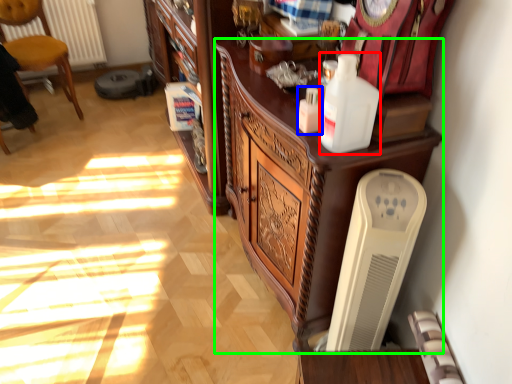
Question: Which object is positioned farthest from bottle (highlighted by a red box)? Select from bottle (highlighted by a blue box) and cabinetry (highlighted by a green box).

Choices:
 (A) bottle
 (B) cabinetry

Answer: (B)